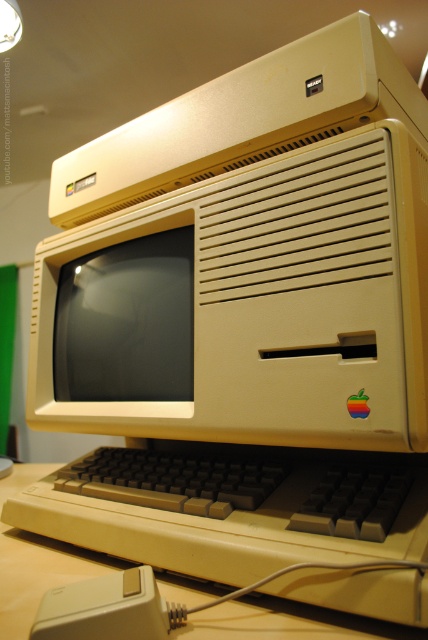
Looking at this image, you have a beige plastic keyboard at center and a white plastic mouse at lower left on your desk. If you want to place both items side by side horizontally, which one should you place first to ensure they fit on the desk without overlapping?

The beige plastic keyboard at center is wider than the white plastic mouse at lower left. Therefore, you should place the beige plastic keyboard at center first on the side where you have more space, followed by the white plastic mouse at lower left to ensure they fit without overlapping.

You are setting up a desk for a retro computing exhibit. You have a matte plastic monitor at center and a white plastic mouse at lower left. Which object is taller?

The matte plastic monitor at center is taller than the white plastic mouse at lower left according to the description.